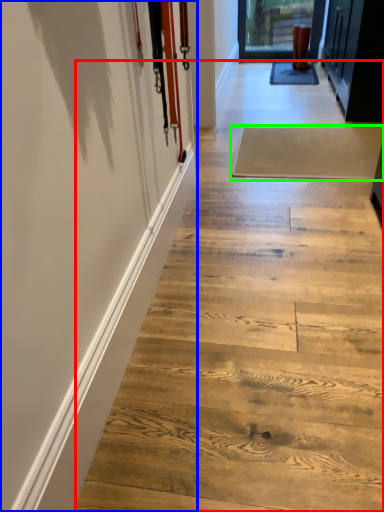
Question: Based on their relative distances, which object is farther from stair (highlighted by a red box)? Choose from barn door (highlighted by a blue box) and plank (highlighted by a green box).

Choices:
 (A) barn door
 (B) plank

Answer: (B)